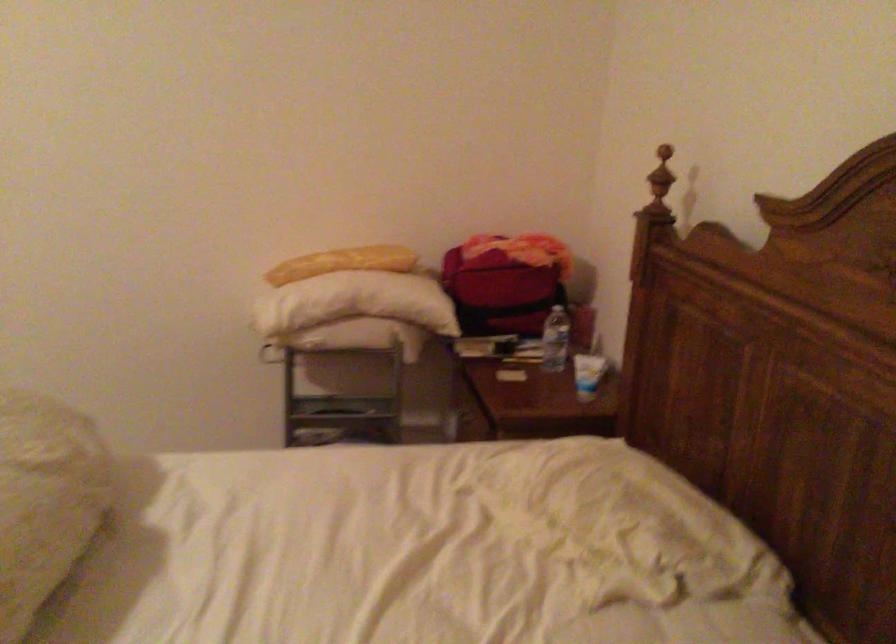
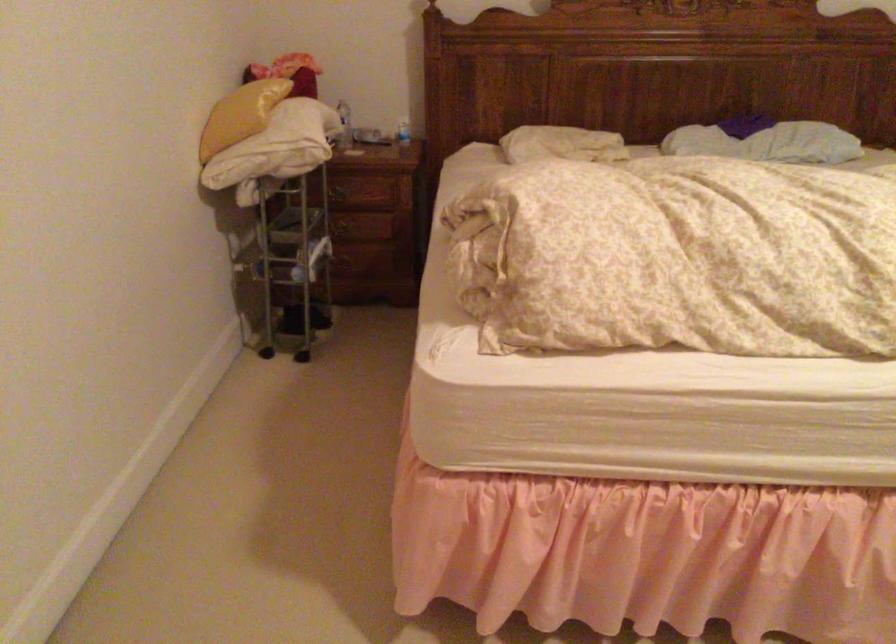
The point at [445,326] is marked in the first image. Where is the corresponding point in the second image?

(343, 125)